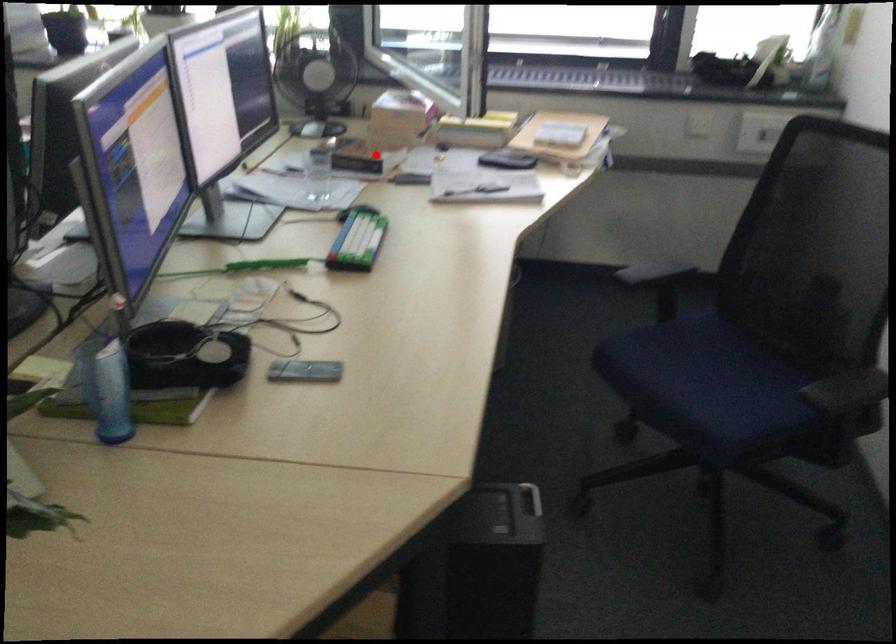
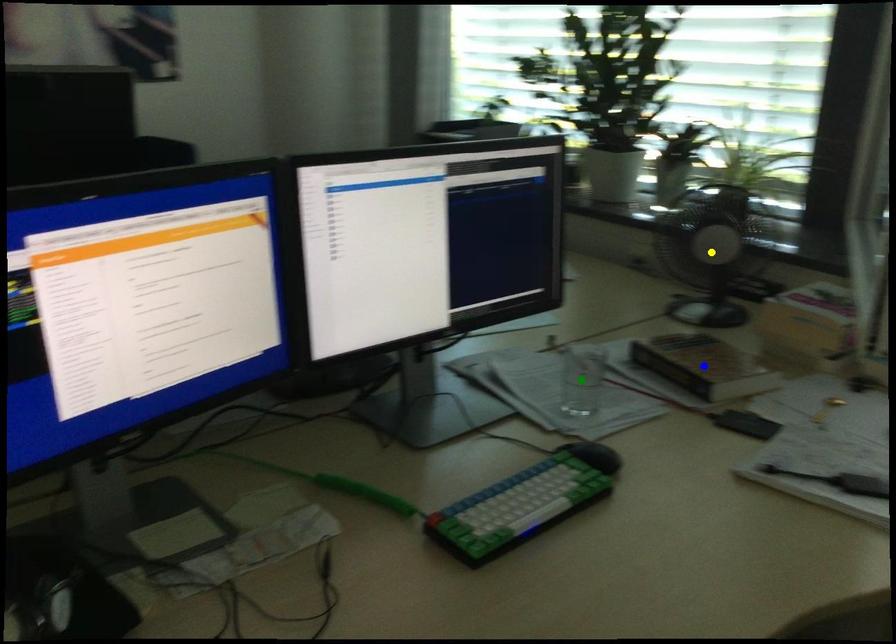
Question: I am providing you with two images of the same scene from different viewpoints. A red point is marked on the first image. You are given multiple points on the second image. Which mark in image 2 goes with the point in image 1?

Choices:
 (A) green point
 (B) blue point
 (C) yellow point

Answer: (B)